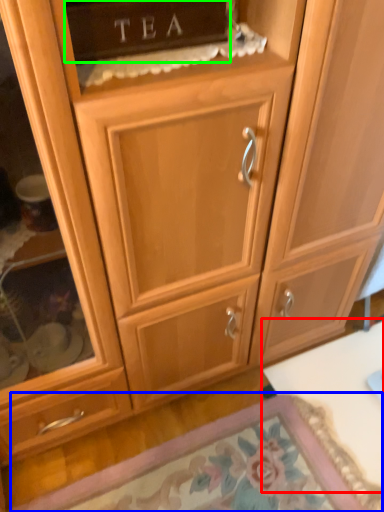
Question: Which is nearer to the table (highlighted by a red box)? door (highlighted by a blue box) or cabinetry (highlighted by a green box).

Choices:
 (A) door
 (B) cabinetry

Answer: (A)